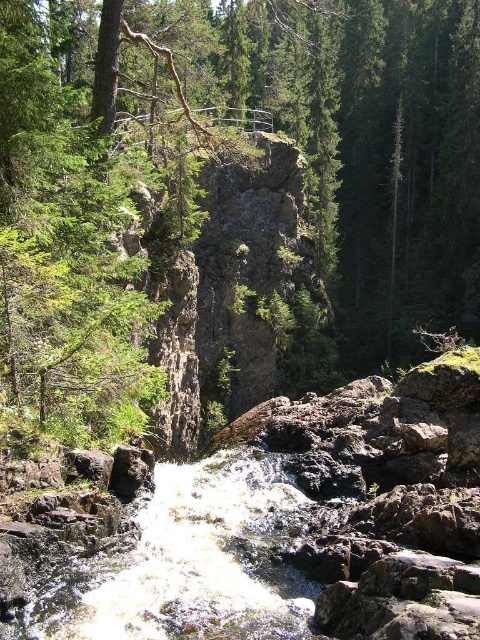
You are standing at the point marked as point (233, 193) in the image. What object is located exactly at that point?

The green rough tree at center is located exactly at point (233, 193).

You are a hiker trying to cross the stream near the green rough tree at center and the white frothy water at center. Which object is closer to you as you approach the stream?

The green rough tree at center is closer to you because it is positioned further to the viewer than the white frothy water at center.